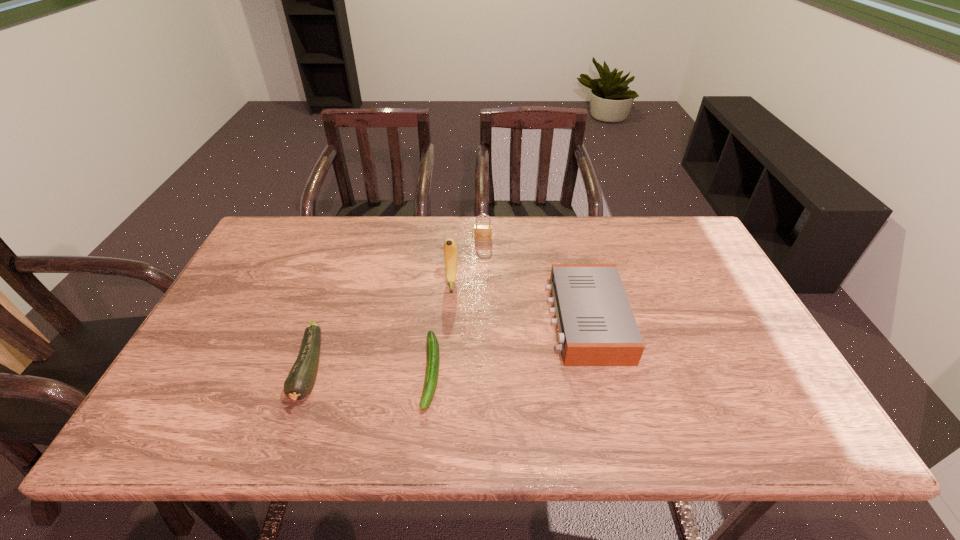
I want to click on free space located on the control panel of the radio receiver, so click(403, 321).

Find the location of `vacant space located on the control panel of the radio receiver`. vacant space located on the control panel of the radio receiver is located at coordinates (407, 321).

Locate an element on the screen. vacant space situated on the control panel of the radio receiver is located at coordinates (501, 321).

I want to click on vacant position located 0.060m at the blossom end of the left zucchini, so click(x=286, y=440).

You are a GUI agent. You are given a task and a screenshot of the screen. Output one action in this format:
    pyautogui.click(x=<x>, y=<y>)
    Task: Click on the object at the far edge
    The height and width of the screenshot is (540, 960).
    Given the screenshot: What is the action you would take?
    pyautogui.click(x=482, y=232)

Locate an element on the screen. blank space at the far edge is located at coordinates (455, 227).

Where is `free region at the near edge`? The height and width of the screenshot is (540, 960). free region at the near edge is located at coordinates (543, 417).

I want to click on vacant area at the left edge, so click(x=240, y=347).

This screenshot has width=960, height=540. Find the location of `vacant space at the right edge of the desktop`. vacant space at the right edge of the desktop is located at coordinates (734, 349).

The image size is (960, 540). I want to click on free spot at the far left corner of the desktop, so click(x=279, y=243).